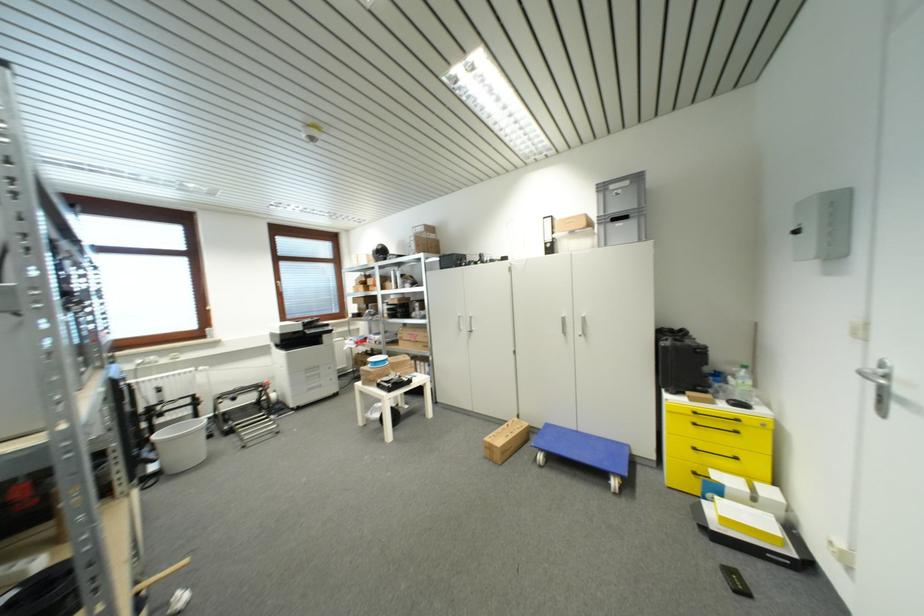
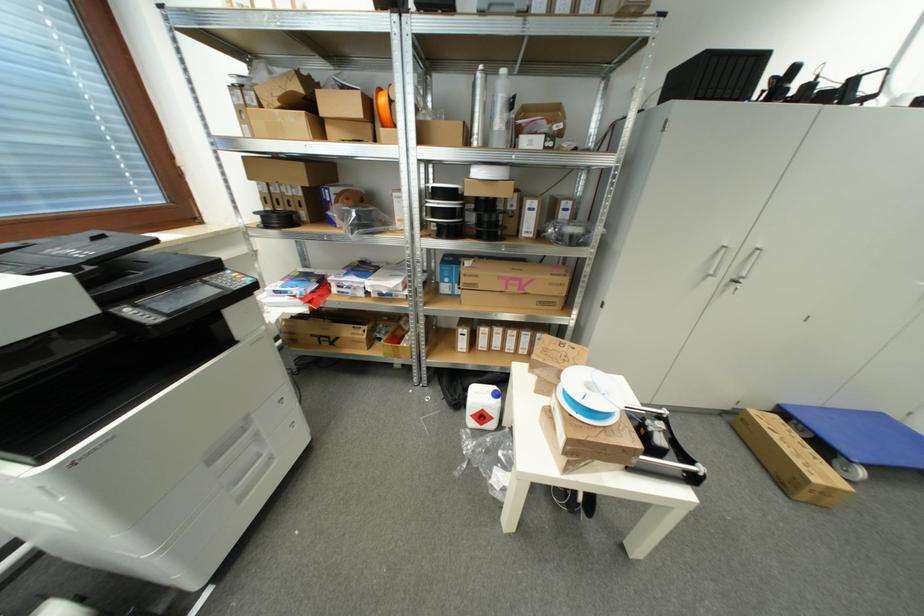
Find the pixel in the second image that matches the point at 323,377 in the first image.

(261, 438)